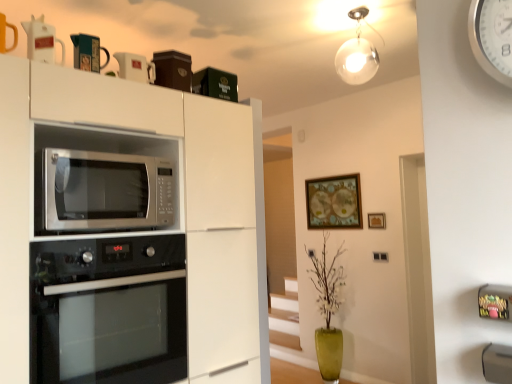
Question: Considering the relative positions of black glass oven at lower left and white plastic clock at upper right in the image provided, is black glass oven at lower left in front of white plastic clock at upper right?

Choices:
 (A) yes
 (B) no

Answer: (B)

Question: Can we say black glass oven at lower left lies outside white plastic clock at upper right?

Choices:
 (A) yes
 (B) no

Answer: (A)

Question: Can you confirm if black glass oven at lower left is bigger than white plastic clock at upper right?

Choices:
 (A) no
 (B) yes

Answer: (B)

Question: Is black glass oven at lower left facing away from white plastic clock at upper right?

Choices:
 (A) yes
 (B) no

Answer: (B)

Question: Does black glass oven at lower left have a smaller size compared to white plastic clock at upper right?

Choices:
 (A) yes
 (B) no

Answer: (B)

Question: In terms of width, does matte black mug at upper center, arranged as the 2th appliance when viewed from the front, look wider or thinner when compared to wooden picture frame at upper center, which appears as the second picture frame when viewed from the left?

Choices:
 (A) wide
 (B) thin

Answer: (A)

Question: In the image, is matte black mug at upper center, which appears as the 2th appliance when viewed from the back, positioned in front of or behind wooden picture frame at upper center, the 1th picture frame viewed from the front?

Choices:
 (A) front
 (B) behind

Answer: (A)

Question: Considering the positions of matte black mug at upper center, which appears as the 2th appliance when viewed from the back, and wooden picture frame at upper center, which appears as the second picture frame when viewed from the left, in the image, is matte black mug at upper center, which appears as the 2th appliance when viewed from the back, bigger or smaller than wooden picture frame at upper center, which appears as the second picture frame when viewed from the left,?

Choices:
 (A) big
 (B) small

Answer: (A)

Question: Considering the relative positions of matte black mug at upper center, which appears as the 2th appliance when viewed from the back, and wooden picture frame at upper center, the 1th picture frame viewed from the front, in the image provided, is matte black mug at upper center, which appears as the 2th appliance when viewed from the back, to the left or to the right of wooden picture frame at upper center, the 1th picture frame viewed from the front,?

Choices:
 (A) left
 (B) right

Answer: (A)

Question: In the image, is white plastic clock at upper right on the left side or the right side of matte black mug at upper center, arranged as the 2th appliance when viewed from the front?

Choices:
 (A) right
 (B) left

Answer: (A)

Question: Is point (473, 21) closer or farther from the camera than point (90, 52)?

Choices:
 (A) farther
 (B) closer

Answer: (B)

Question: In terms of width, does white plastic clock at upper right look wider or thinner when compared to matte black mug at upper center, which appears as the 2th appliance when viewed from the back?

Choices:
 (A) thin
 (B) wide

Answer: (A)

Question: From the image's perspective, relative to matte black mug at upper center, arranged as the 2th appliance when viewed from the front, is white plastic clock at upper right above or below?

Choices:
 (A) above
 (B) below

Answer: (B)

Question: Is satin silver microwave at center situated inside matte black mug at upper center, which appears as the 2th appliance when viewed from the back, or outside?

Choices:
 (A) inside
 (B) outside

Answer: (B)

Question: Looking at the image, does satin silver microwave at center seem bigger or smaller compared to matte black mug at upper center, arranged as the 2th appliance when viewed from the front?

Choices:
 (A) big
 (B) small

Answer: (A)